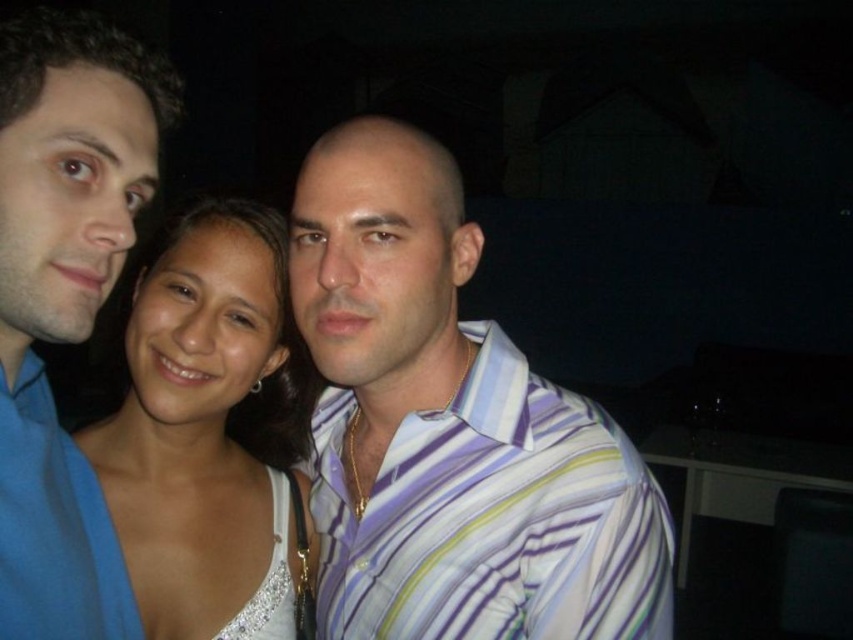
Question: Does striped cotton shirt at center appear under blue smooth shirt at left?

Choices:
 (A) yes
 (B) no

Answer: (A)

Question: Which point is farther from the camera taking this photo?

Choices:
 (A) (585, 604)
 (B) (0, 545)
 (C) (213, 365)
 (D) (267, 580)

Answer: (D)

Question: Can you confirm if white satin dress at center is wider than white sequined dress at center?

Choices:
 (A) no
 (B) yes

Answer: (B)

Question: Considering the real-world distances, which object is farthest from the white satin dress at center?

Choices:
 (A) blue smooth shirt at left
 (B) striped cotton shirt at center

Answer: (A)

Question: Which object is farther from the camera taking this photo?

Choices:
 (A) blue smooth shirt at left
 (B) striped cotton shirt at center
 (C) white sequined dress at center
 (D) white satin dress at center

Answer: (C)

Question: Is white satin dress at center thinner than white sequined dress at center?

Choices:
 (A) yes
 (B) no

Answer: (B)